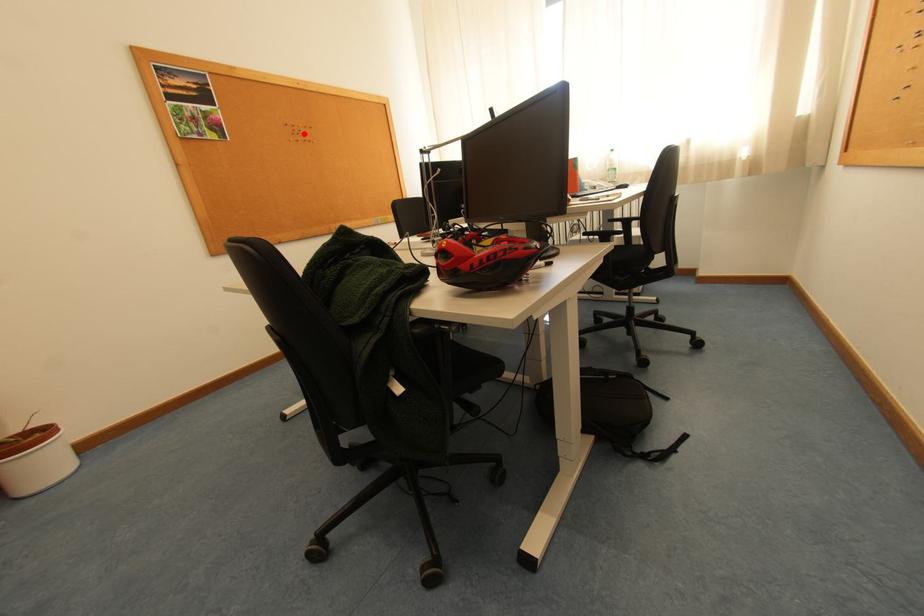
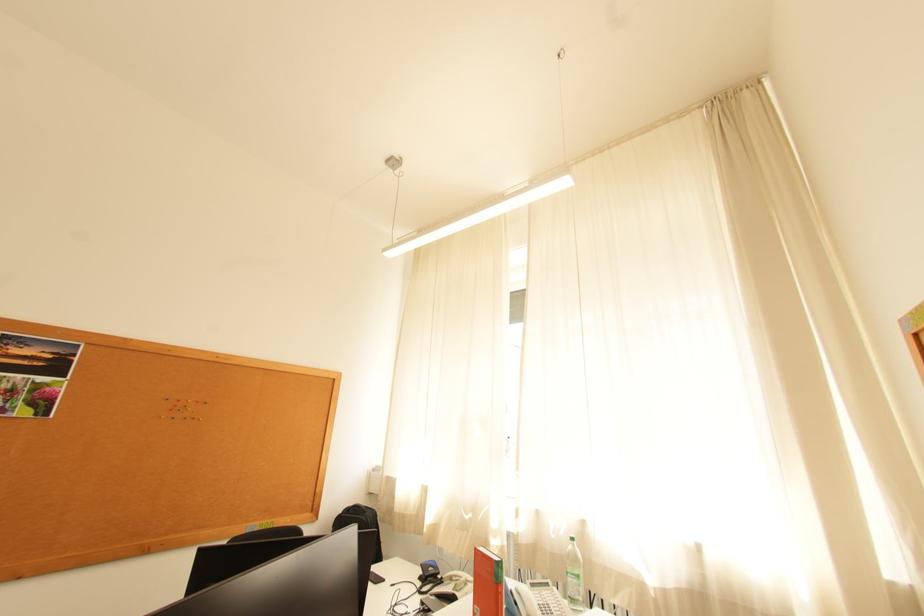
The point at the highlighted location is marked in the first image. Where is the corresponding point in the second image?

(186, 408)